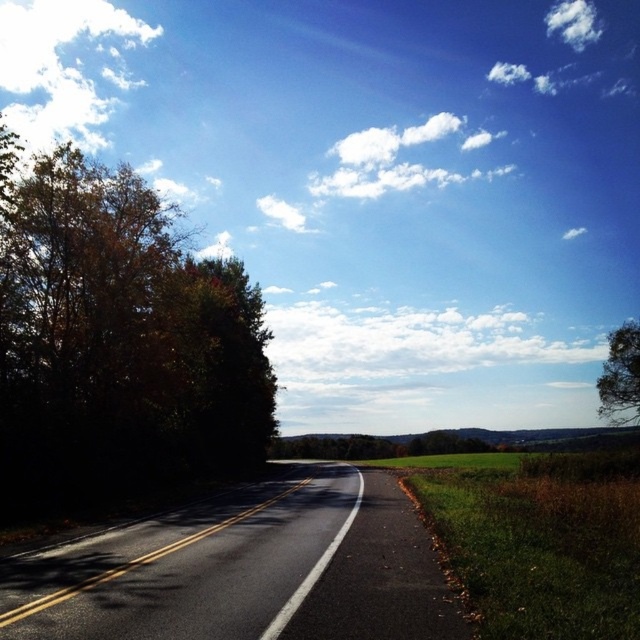
You are a driver approaching the green leafy tree at left and the black asphalt road at center. Which object will you see first as you drive forward?

You will see the green leafy tree at left first because it is in front of the black asphalt road at center.

You are driving a car and see two points on the road ahead. The first point is at coordinates point (419, 620) and the second is at point (627, 340). Which point is closer to your current position?

Point (419, 620) is closer to the viewer than point (627, 340), so the first point is closer to your current position.

You are a painter standing on the road and want to paint both the green leafy tree at left and the green leafy tree at right. Which tree should you paint first if you want to paint the larger one first?

The green leafy tree at left is larger in size than the green leafy tree at right, so you should paint the green leafy tree at left first.